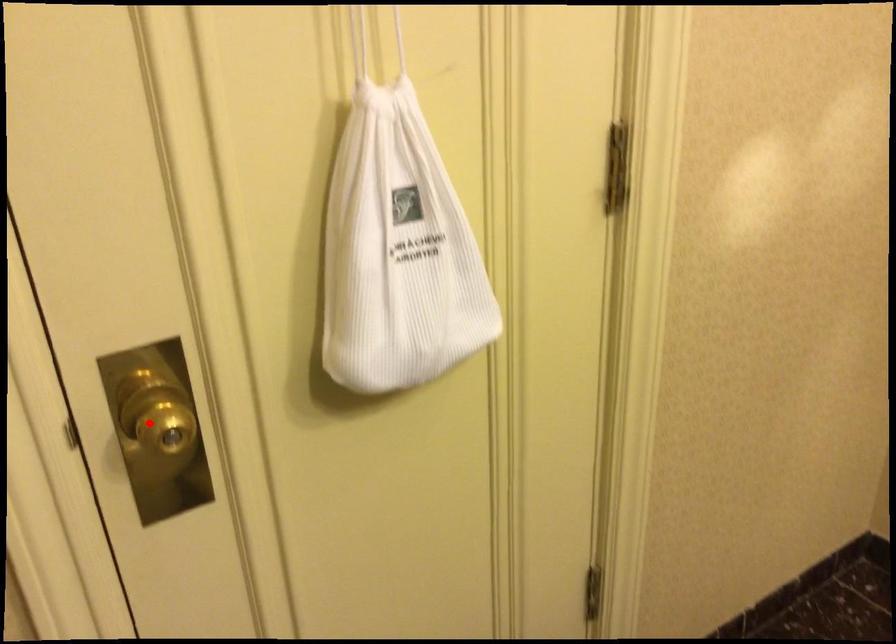
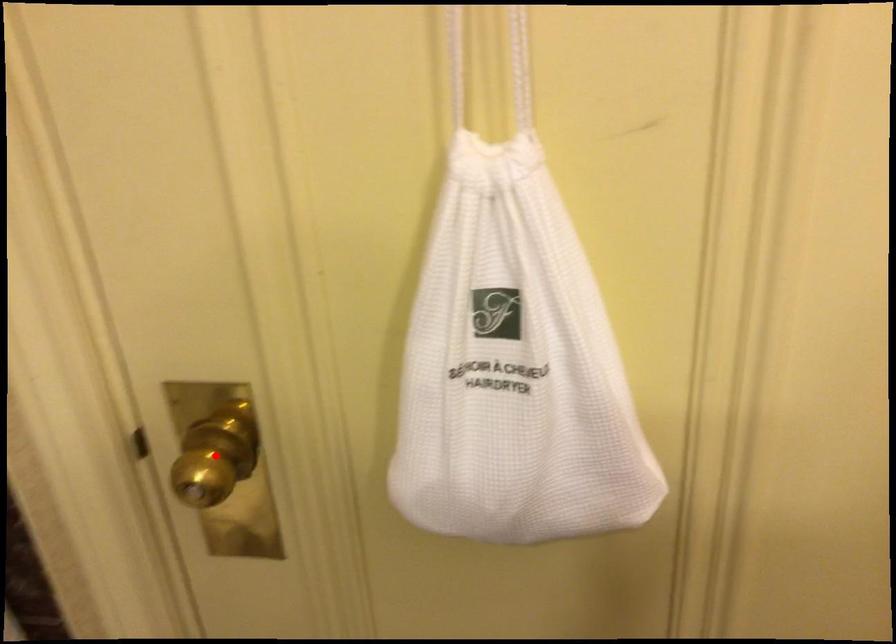
I am providing you with two images of the same scene from different viewpoints. A red point is marked on the first image and another point is marked on the second image. Are the points marked in image1 and image2 representing the same 3D position?

Yes